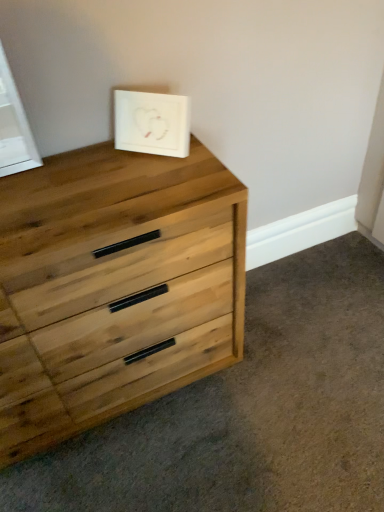
Question: Based on their sizes in the image, would you say white matte picture frame at upper center is bigger or smaller than natural wood chest of drawers at upper left?

Choices:
 (A) small
 (B) big

Answer: (A)

Question: Visually, is white matte picture frame at upper center positioned to the left or to the right of natural wood chest of drawers at upper left?

Choices:
 (A) right
 (B) left

Answer: (A)

Question: Relative to natural wood chest of drawers at upper left, is white matte picture frame at upper center in front or behind?

Choices:
 (A) front
 (B) behind

Answer: (B)

Question: From a real-world perspective, is natural wood chest of drawers at upper left above or below white matte picture frame at upper center?

Choices:
 (A) above
 (B) below

Answer: (B)

Question: Considering the positions of natural wood chest of drawers at upper left and white matte picture frame at upper center in the image, is natural wood chest of drawers at upper left taller or shorter than white matte picture frame at upper center?

Choices:
 (A) short
 (B) tall

Answer: (B)

Question: From the image's perspective, relative to white matte picture frame at upper center, is natural wood chest of drawers at upper left above or below?

Choices:
 (A) above
 (B) below

Answer: (B)

Question: Is natural wood chest of drawers at upper left to the left or to the right of white matte picture frame at upper center in the image?

Choices:
 (A) right
 (B) left

Answer: (B)